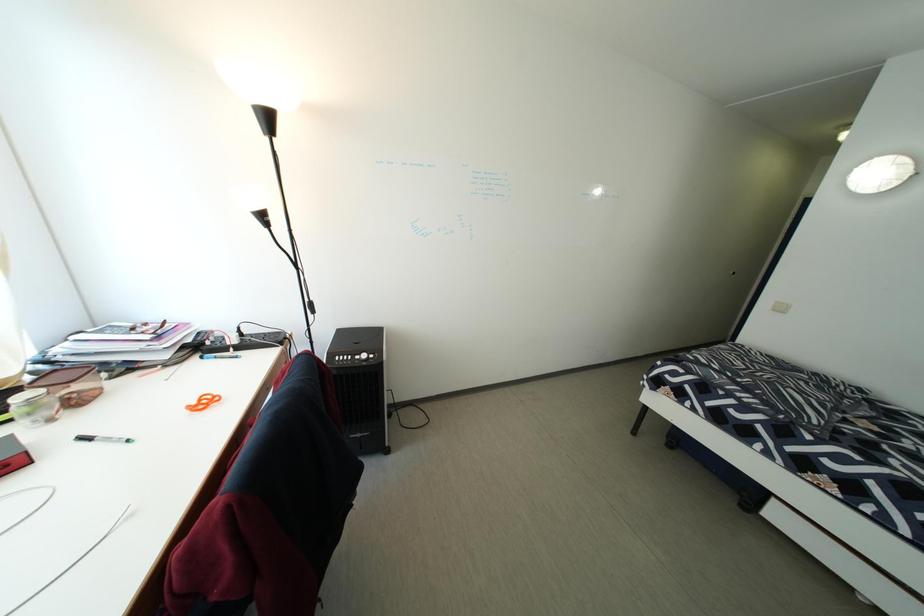
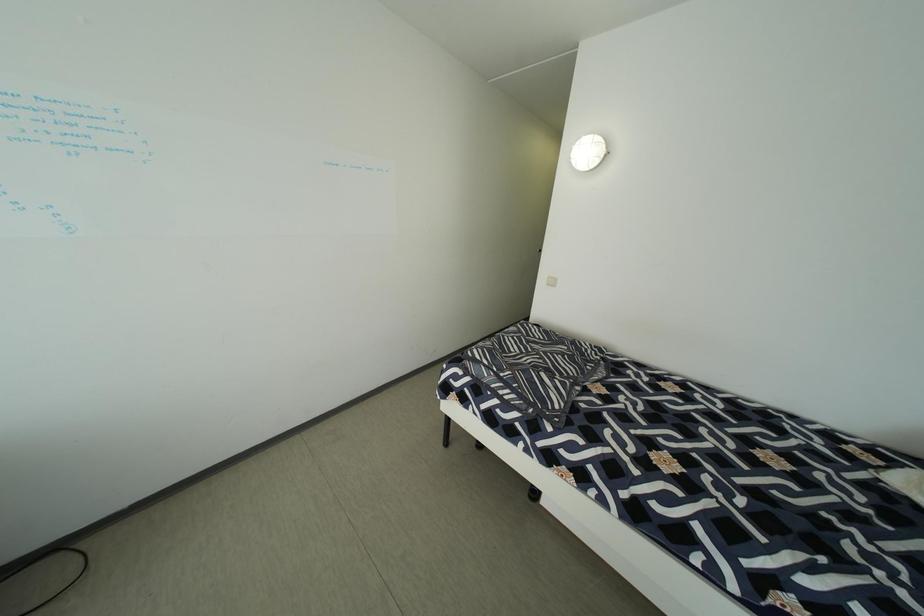
Question: The images are taken continuously from a first-person perspective. In which direction is your viewpoint rotating?

Choices:
 (A) Left
 (B) Right
 (C) Up
 (D) Down

Answer: (B)